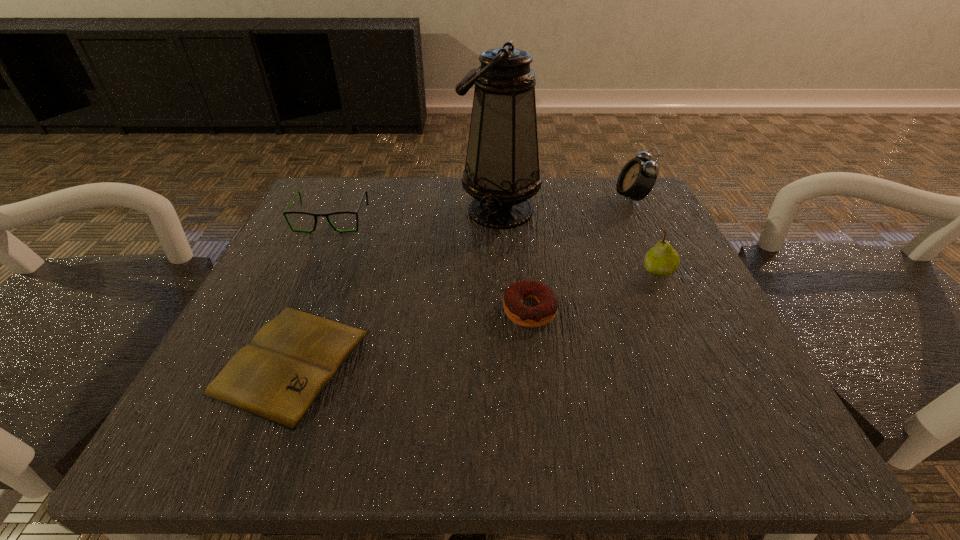
The width and height of the screenshot is (960, 540). I want to click on the tallest object, so click(501, 172).

Where is `alarm clock`? The image size is (960, 540). alarm clock is located at coordinates (637, 178).

You are a GUI agent. You are given a task and a screenshot of the screen. Output one action in this format:
    pyautogui.click(x=<x>, y=<y>)
    Task: Click on the pear
    This screenshot has height=540, width=960.
    Given the screenshot: What is the action you would take?
    pyautogui.click(x=662, y=260)

At what (x,y) coordinates should I click in order to perform the action: click on the fourth shortest object. Please return your answer as a coordinate pair (x, y). Looking at the image, I should click on (662, 260).

This screenshot has width=960, height=540. Find the location of `the fourth tallest object`. the fourth tallest object is located at coordinates (285, 212).

Locate an element on the screen. the second shortest object is located at coordinates (522, 315).

Find the location of a particular element. the shortest object is located at coordinates (278, 376).

Where is `free region located on the left of the oil lamp`? This screenshot has width=960, height=540. free region located on the left of the oil lamp is located at coordinates (426, 211).

Image resolution: width=960 pixels, height=540 pixels. I want to click on free space located 0.360m on the face of the alarm clock, so click(x=450, y=198).

You are a GUI agent. You are given a task and a screenshot of the screen. Output one action in this format:
    pyautogui.click(x=<x>, y=<y>)
    Task: Click on the free space located 0.230m on the face of the alarm clock
    This screenshot has width=960, height=540.
    Given the screenshot: What is the action you would take?
    pyautogui.click(x=510, y=198)